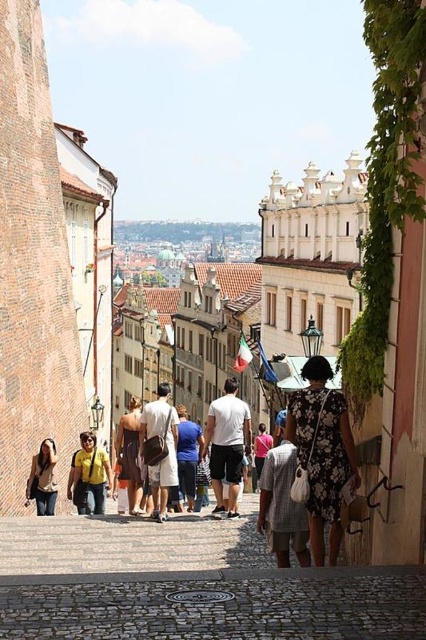
You are a delivery person carrying a large package that is 1.2 meters wide. You need to navigate through the cobblestone path at center while avoiding the light brown leather jacket at lower left. Can your package fit through the path?

The cobblestone path at center is wider than the light brown leather jacket at lower left. Since the package is 1.2 meters wide, and the path is wider than the jacket, but the exact width of the path isn